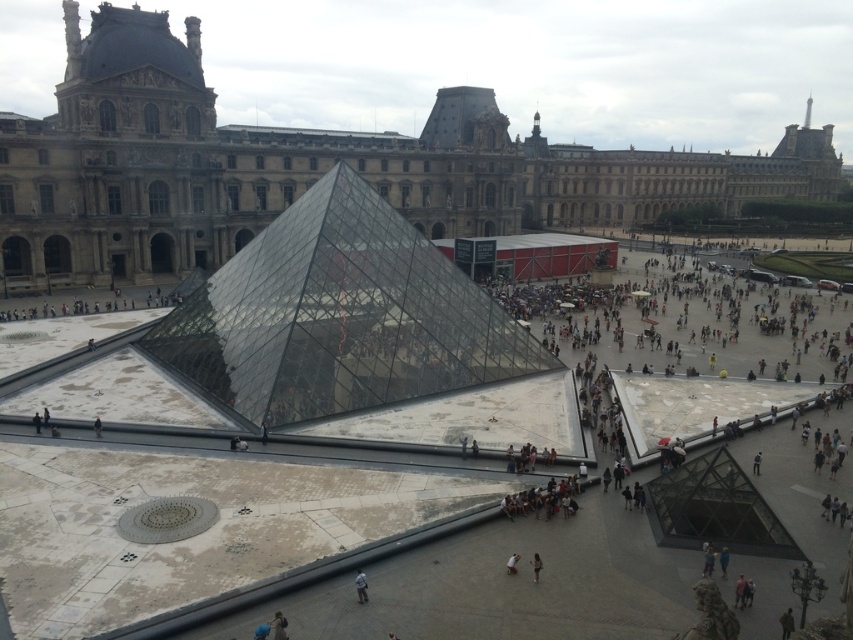
Question: Is the position of white fabric person at center less distant than that of black fabric person at center?

Choices:
 (A) no
 (B) yes

Answer: (B)

Question: Where is matte glass pyramid at center located in relation to light gray fabric jacket at center in the image?

Choices:
 (A) above
 (B) below

Answer: (A)

Question: Can you confirm if matte glass pyramid at center is bigger than light brown fabric dress at center?

Choices:
 (A) no
 (B) yes

Answer: (B)

Question: Among these objects, which one is nearest to the camera?

Choices:
 (A) light brown fabric dress at center
 (B) light gray fabric jacket at center

Answer: (B)

Question: Which of the following is the closest to the observer?

Choices:
 (A) black fabric person at center
 (B) light brown fabric dress at center

Answer: (B)

Question: Which point is farther from the camera taking this photo?

Choices:
 (A) (508, 560)
 (B) (538, 570)
 (C) (93, 420)
 (D) (357, 577)

Answer: (C)